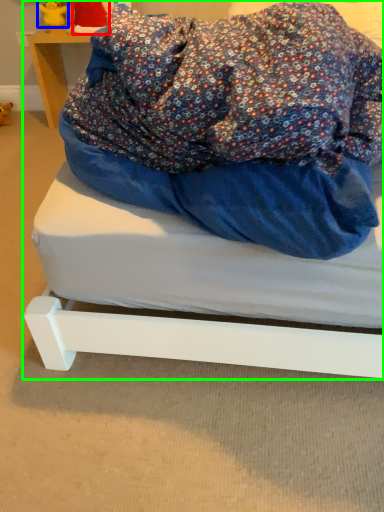
Question: Which is farther away from toy (highlighted by a red box)? figurine (highlighted by a blue box) or bed (highlighted by a green box)?

Choices:
 (A) figurine
 (B) bed

Answer: (B)